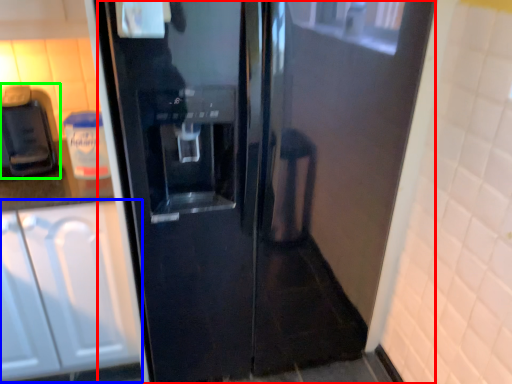
Question: Based on their relative distances, which object is nearer to door (highlighted by a red box)? Choose from cabinetry (highlighted by a blue box) and coffee machine (highlighted by a green box).

Choices:
 (A) cabinetry
 (B) coffee machine

Answer: (A)